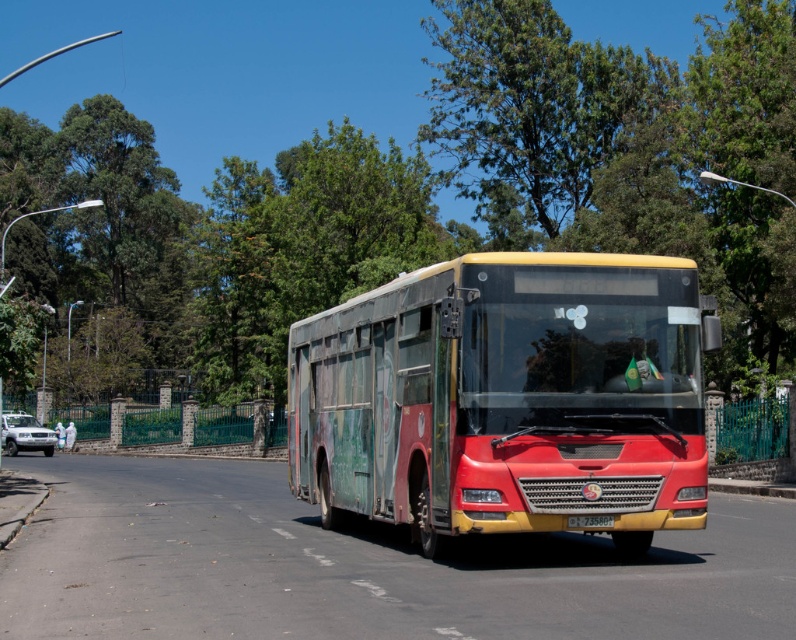
You are a pedestrian standing at the crosswalk in front of the bus. You need to walk to the yellow matte license plate at center. Is the metallic silver suv at lower left blocking your path?

The yellow matte license plate at center is behind the metallic silver suv at lower left, so the metallic silver suv at lower left is blocking the path to the yellow matte license plate at center.

You are a driver approaching the bus and need to park your metallic silver suv at lower left. The parking spot has a width restriction that matches the yellow matte license plate at center. Will your suv fit in the parking spot?

The metallic silver suv at lower left is thinner than the yellow matte license plate at center, so it will fit in the parking spot with the width restriction matching the yellow matte license plate at center.

You are standing at the bus stop near the public bus. Looking at the scene, where is the green leafy tree at upper center located in terms of its 2D coordinates?

The green leafy tree at upper center is located at the 2D coordinates point (539, 115).